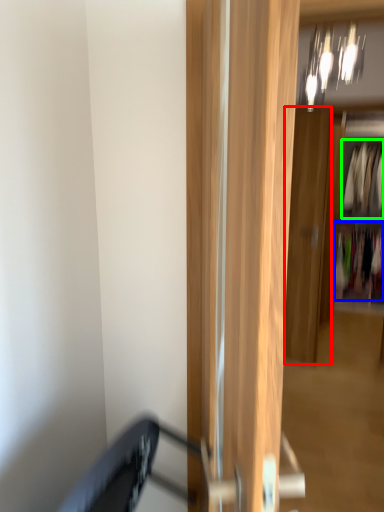
Question: Which is nearer to the door (highlighted by a red box)? clothing (highlighted by a blue box) or clothing (highlighted by a green box).

Choices:
 (A) clothing
 (B) clothing

Answer: (A)